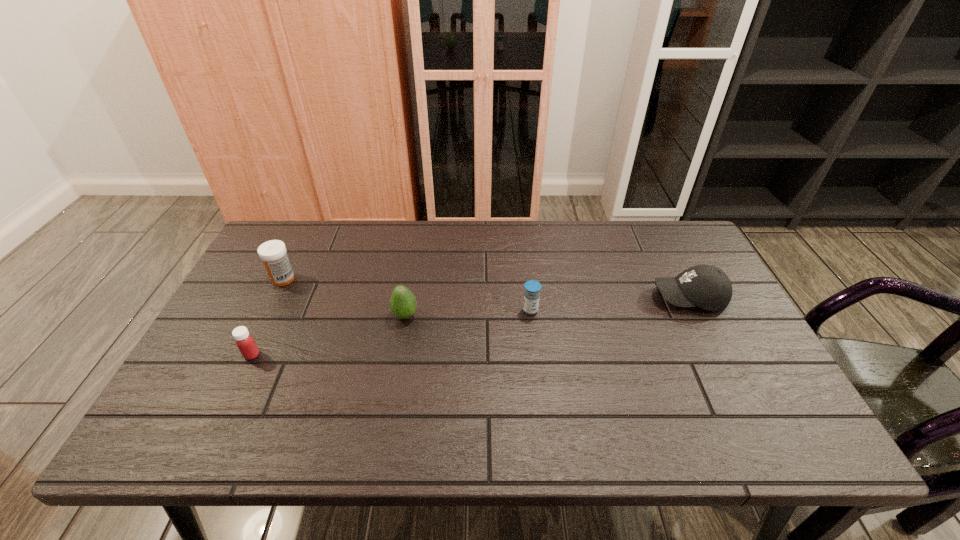
Find the location of a particular element. This screenshot has height=540, width=960. the farthest medicine is located at coordinates (273, 253).

Image resolution: width=960 pixels, height=540 pixels. In order to click on the third object from right to left in this screenshot , I will do `click(403, 303)`.

The height and width of the screenshot is (540, 960). Identify the location of the rightmost object. (705, 286).

Identify the location of the second farthest medicine. The height and width of the screenshot is (540, 960). (532, 288).

Where is `the fourth object from left to right`? This screenshot has height=540, width=960. the fourth object from left to right is located at coordinates (532, 288).

Where is `the nearest object`? This screenshot has width=960, height=540. the nearest object is located at coordinates (244, 341).

Image resolution: width=960 pixels, height=540 pixels. What are the coordinates of `free location located 0.250m on the back of the farthest medicine` in the screenshot? It's located at (311, 223).

What are the coordinates of `blank space located on the right of the avocado` in the screenshot? It's located at (474, 315).

Find the location of `free region located 0.130m on the front-facing side of the baseball cap`. free region located 0.130m on the front-facing side of the baseball cap is located at coordinates (606, 298).

The width and height of the screenshot is (960, 540). I want to click on vacant space located on the front-facing side of the baseball cap, so click(574, 298).